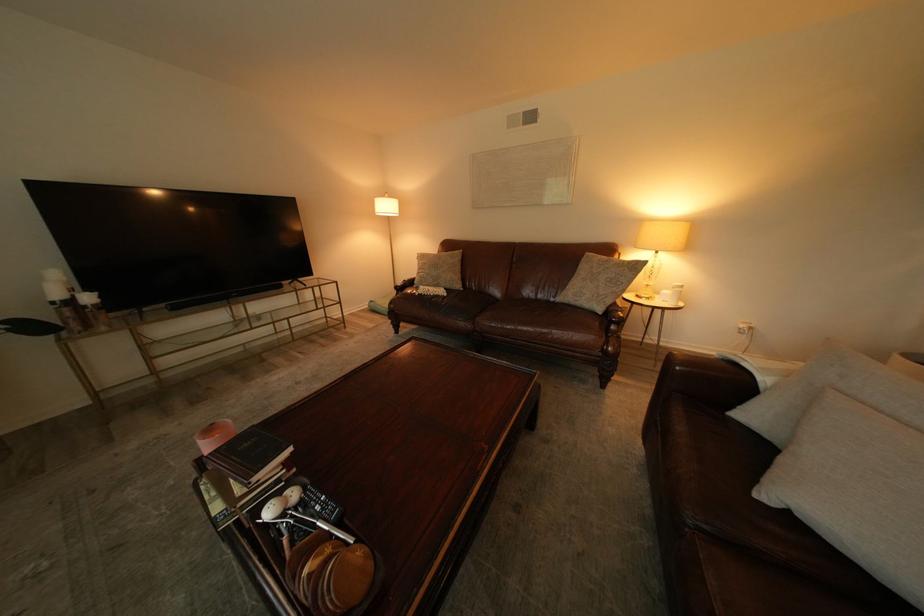
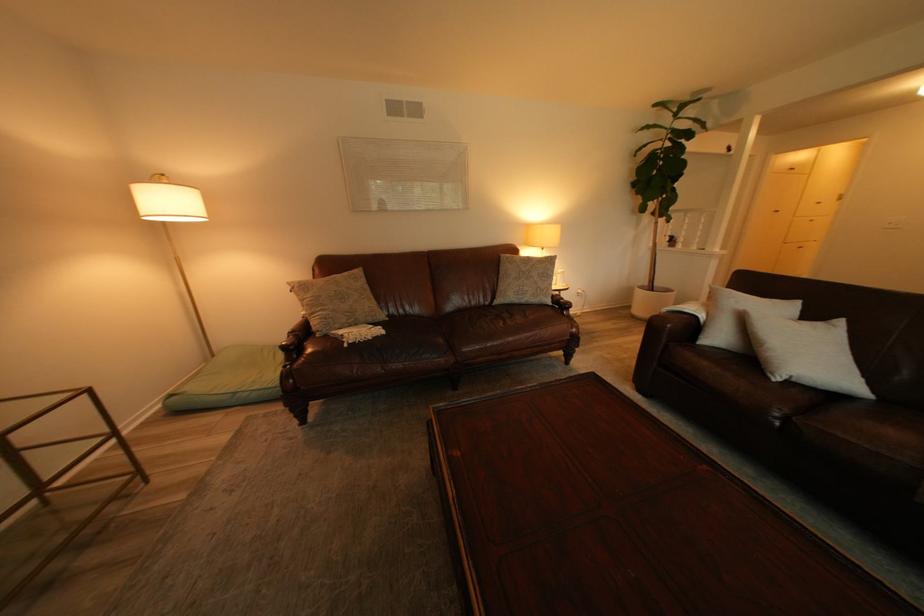
Find the pixel in the second image that matches (x=385, y=302) in the first image.

(186, 395)